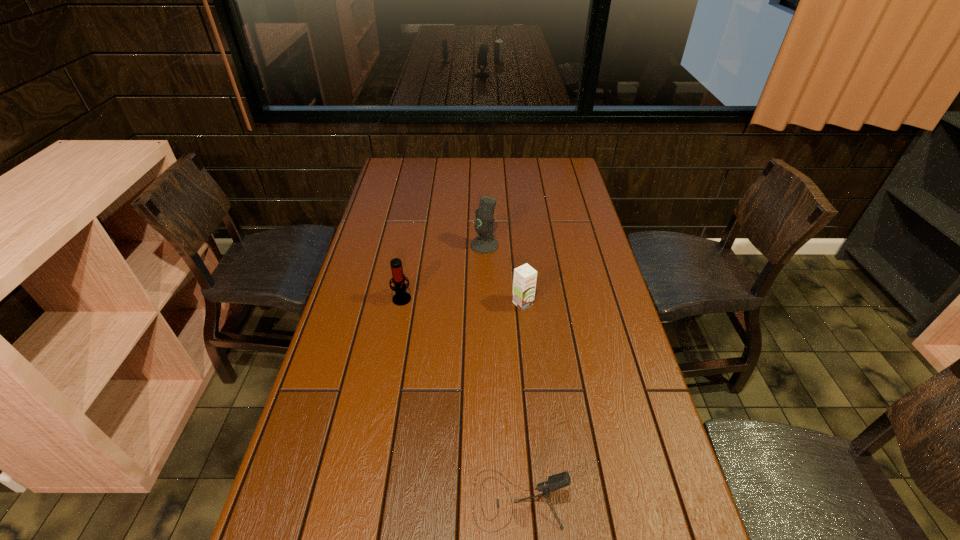
Identify the location of the tallest object. (484, 244).

Identify the location of the farthest microphone. (484, 244).

Find the location of `the leftmost microphone`. the leftmost microphone is located at coordinates (401, 298).

You are a GUI agent. You are given a task and a screenshot of the screen. Output one action in this format:
    pyautogui.click(x=<x>, y=<y>)
    Task: Click on the leftmost object
    The width and height of the screenshot is (960, 540).
    Given the screenshot: What is the action you would take?
    pyautogui.click(x=401, y=298)

Identify the location of chocolate milk. (524, 283).

This screenshot has height=540, width=960. I want to click on the shortest object, so click(560, 480).

Where is `the shortest microphone`? This screenshot has height=540, width=960. the shortest microphone is located at coordinates (560, 480).

This screenshot has width=960, height=540. I want to click on free spot located 0.090m on the front of the tallest microphone, so click(x=485, y=271).

Identify the location of vacant space located 0.120m on the front of the leftmost object. (395, 336).

The width and height of the screenshot is (960, 540). What are the coordinates of `vacant region located 0.390m on the front of the chocolate milk` in the screenshot? It's located at (536, 434).